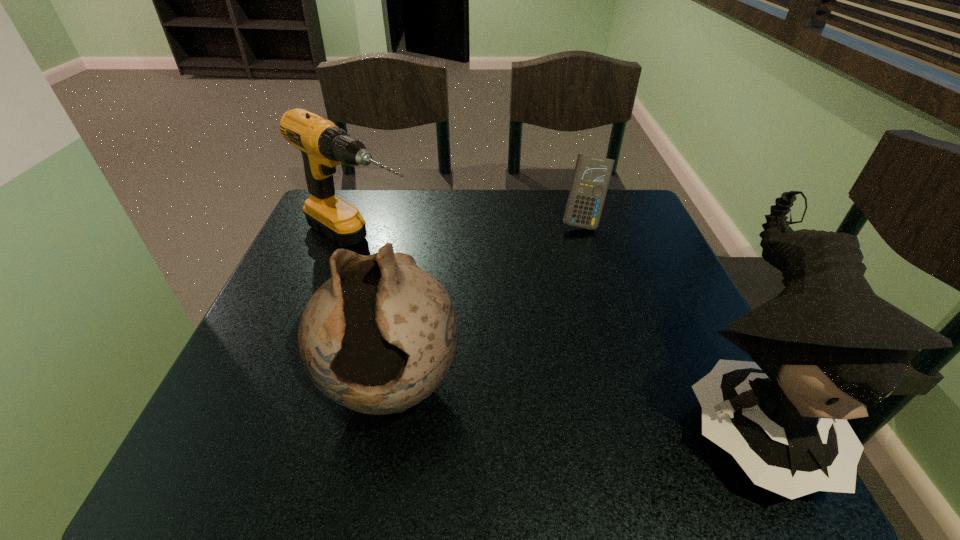
Locate an element on the screen. Image resolution: width=960 pixels, height=540 pixels. calculator that is at the far edge is located at coordinates (592, 174).

Image resolution: width=960 pixels, height=540 pixels. What are the coordinates of `drill that is at the far edge` in the screenshot? It's located at (323, 145).

You are a GUI agent. You are given a task and a screenshot of the screen. Output one action in this format:
    pyautogui.click(x=<x>, y=<y>)
    Task: Click on the pottery at the near edge
    
    Given the screenshot: What is the action you would take?
    pyautogui.click(x=378, y=337)

You are a GUI agent. You are given a task and a screenshot of the screen. Output one action in this format:
    pyautogui.click(x=<x>, y=<y>)
    Task: Click on the doll at the near edge
    The height and width of the screenshot is (540, 960).
    Given the screenshot: What is the action you would take?
    pyautogui.click(x=824, y=349)

Where is `object at the left edge`? Image resolution: width=960 pixels, height=540 pixels. object at the left edge is located at coordinates (323, 145).

This screenshot has width=960, height=540. Identify the location of doll present at the right edge. (824, 349).

Identify the location of calculator that is positioned at the right edge. Image resolution: width=960 pixels, height=540 pixels. (592, 174).

Locate an element on the screen. This screenshot has width=960, height=540. object that is positioned at the far left corner is located at coordinates (323, 145).

Image resolution: width=960 pixels, height=540 pixels. Identify the location of object at the far right corner. (592, 174).

Where is `object present at the near right corner`? Image resolution: width=960 pixels, height=540 pixels. object present at the near right corner is located at coordinates (824, 349).